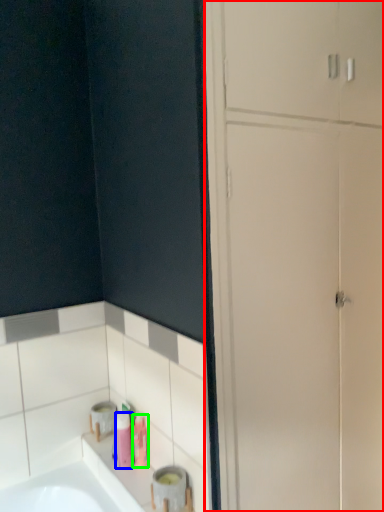
Question: Estimate the real-world distances between objects in this image. Which object is farther from dresser (highlighted by a red box), toiletry (highlighted by a blue box) or toiletry (highlighted by a green box)?

Choices:
 (A) toiletry
 (B) toiletry

Answer: (A)